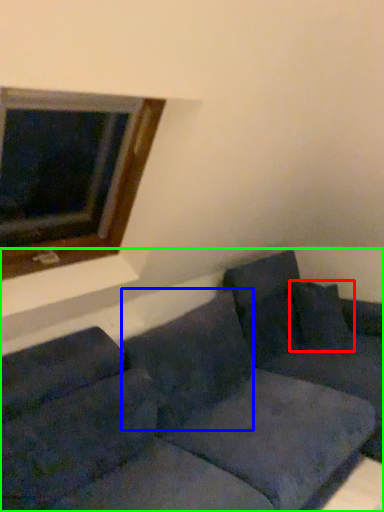
Question: Which object is the closest to the pillow (highlighted by a red box)? Choose among these: pillow (highlighted by a blue box) or studio couch (highlighted by a green box).

Choices:
 (A) pillow
 (B) studio couch

Answer: (B)